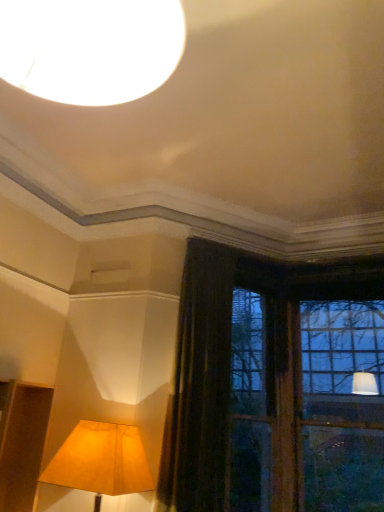
Question: Looking at their shapes, would you say dark velvet curtain at center is wider or thinner than matte yellow fabric lampshade at lower left?

Choices:
 (A) wide
 (B) thin

Answer: (B)

Question: From the image's perspective, is dark velvet curtain at center above or below matte yellow fabric lampshade at lower left?

Choices:
 (A) above
 (B) below

Answer: (A)

Question: Considering the relative positions of dark velvet curtain at center and matte yellow fabric lampshade at lower left in the image provided, is dark velvet curtain at center to the left or to the right of matte yellow fabric lampshade at lower left?

Choices:
 (A) right
 (B) left

Answer: (A)

Question: From a real-world perspective, relative to dark velvet curtain at center, is matte yellow fabric lampshade at lower left vertically above or below?

Choices:
 (A) below
 (B) above

Answer: (A)

Question: From the image's perspective, is matte yellow fabric lampshade at lower left located above or below dark velvet curtain at center?

Choices:
 (A) below
 (B) above

Answer: (A)

Question: Is matte yellow fabric lampshade at lower left inside the boundaries of dark velvet curtain at center, or outside?

Choices:
 (A) outside
 (B) inside

Answer: (A)

Question: Is matte yellow fabric lampshade at lower left taller or shorter than dark velvet curtain at center?

Choices:
 (A) short
 (B) tall

Answer: (A)